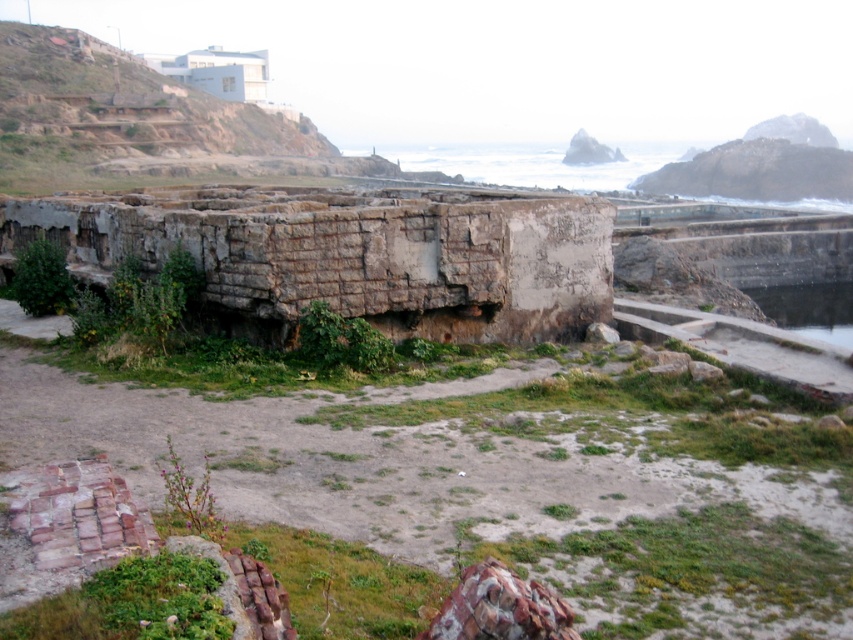
Question: Does rusty concrete ruins at center have a greater width compared to clear water at lower right?

Choices:
 (A) yes
 (B) no

Answer: (A)

Question: Is rusty concrete ruins at center closer to the viewer compared to clear water at lower right?

Choices:
 (A) yes
 (B) no

Answer: (A)

Question: Which point is closer to the camera?

Choices:
 (A) (840, 314)
 (B) (476, 320)

Answer: (B)

Question: Which of the following is the closest to the observer?

Choices:
 (A) (236, 204)
 (B) (786, 288)

Answer: (A)

Question: In this image, where is rusty concrete ruins at center located relative to clear water at lower right?

Choices:
 (A) left
 (B) right

Answer: (A)

Question: Which point is closer to the camera taking this photo?

Choices:
 (A) (799, 330)
 (B) (576, 236)

Answer: (B)